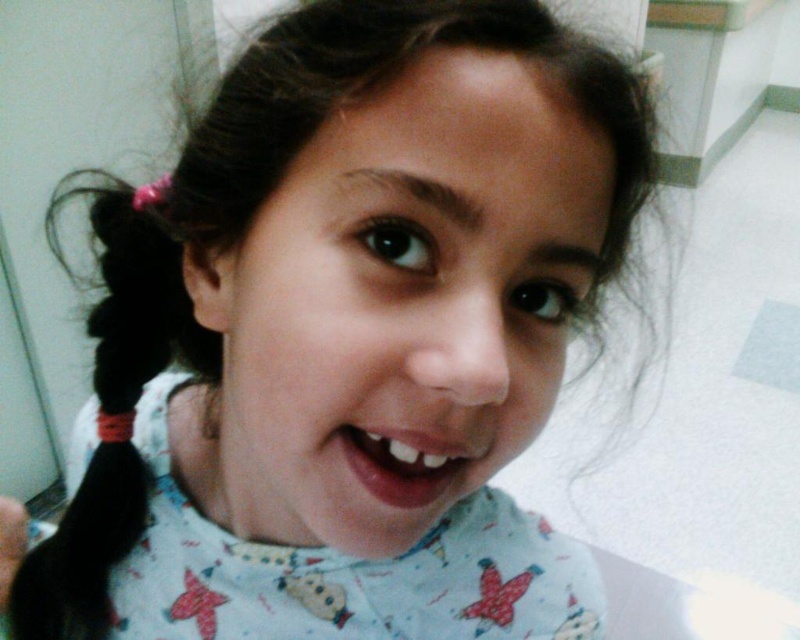
You are a photographer adjusting your camera settings to capture a clear portrait of the young girl. The camera requires the subject to be at least 10 inches away to focus properly. Based on the scene, will the smooth skin face at center be in focus?

The smooth skin face at center is 9.83 inches from the camera, which is less than the required 10 inches. Therefore, the face will not be in focus.

Looking at the young girl in the image, which object is larger when comparing the smooth skin face at center and the smooth skin mouth at center?

The smooth skin face at center is bigger than the smooth skin mouth at center.